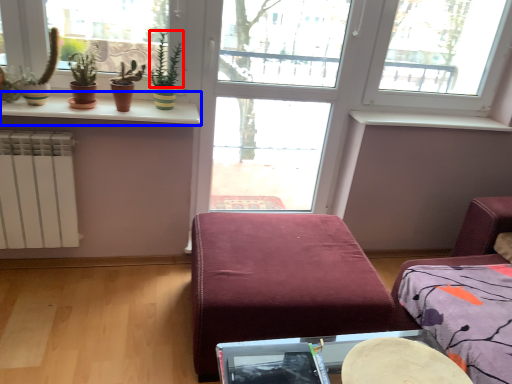
Question: Among these objects, which one is farthest to the camera, plant (highlighted by a red box) or window sill (highlighted by a blue box)?

Choices:
 (A) plant
 (B) window sill

Answer: (A)